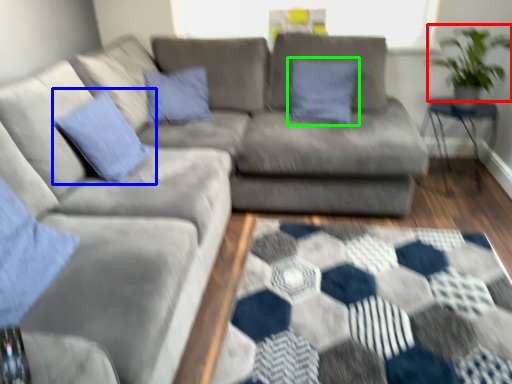
Question: Estimate the real-world distances between objects in this image. Which object is closer to plant (highlighted by a red box), pillow (highlighted by a blue box) or pillow (highlighted by a green box)?

Choices:
 (A) pillow
 (B) pillow

Answer: (B)